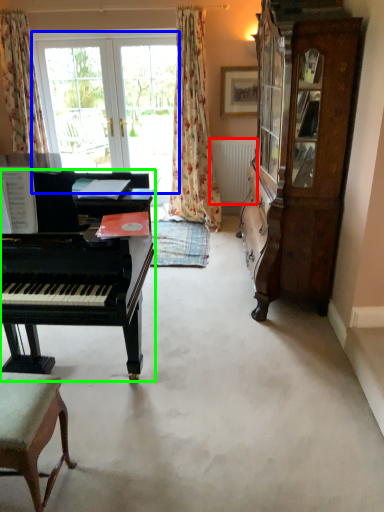
Question: Considering the real-world distances, which object is closest to radiator (highlighted by a red box)? bay window (highlighted by a blue box) or piano (highlighted by a green box).

Choices:
 (A) bay window
 (B) piano

Answer: (A)